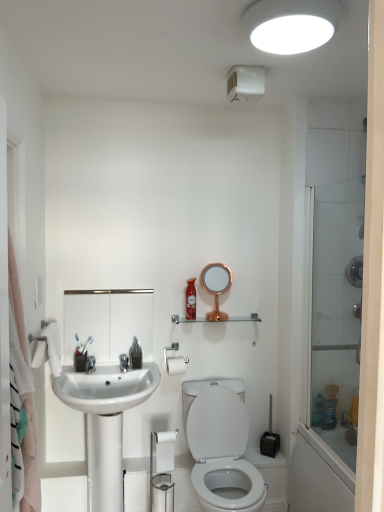
Question: Is white matte toilet paper at center, which appears as the 2th toilet paper when viewed from the front, completely or partially inside white matte toilet paper at lower center, positioned as the second toilet paper in top-to-bottom order?

Choices:
 (A) yes
 (B) no

Answer: (B)

Question: Is white matte toilet paper at lower center, the 1th toilet paper positioned from the bottom, facing away from white matte toilet paper at center, which appears as the 2th toilet paper when viewed from the front?

Choices:
 (A) no
 (B) yes

Answer: (A)

Question: Is white matte toilet paper at lower center, the 2th toilet paper in the back-to-front sequence, oriented towards white matte toilet paper at center, the 1th toilet paper when ordered from top to bottom?

Choices:
 (A) yes
 (B) no

Answer: (B)

Question: Is white matte toilet paper at lower center, the 2th toilet paper in the back-to-front sequence, positioned behind white matte toilet paper at center, the first toilet paper viewed from the back?

Choices:
 (A) yes
 (B) no

Answer: (B)

Question: From a real-world perspective, is white matte toilet paper at lower center, positioned as the second toilet paper in top-to-bottom order, on white matte toilet paper at center, positioned as the 2th toilet paper in bottom-to-top order?

Choices:
 (A) no
 (B) yes

Answer: (A)

Question: Is white glossy toilet at lower center taller or shorter than white matte toilet paper at center, the first toilet paper viewed from the back?

Choices:
 (A) tall
 (B) short

Answer: (A)

Question: Considering the relative positions of white glossy toilet at lower center and white matte toilet paper at center, positioned as the 2th toilet paper in bottom-to-top order, in the image provided, is white glossy toilet at lower center to the left or to the right of white matte toilet paper at center, positioned as the 2th toilet paper in bottom-to-top order,?

Choices:
 (A) right
 (B) left

Answer: (A)

Question: Is white glossy toilet at lower center in front of or behind white matte toilet paper at center, positioned as the 2th toilet paper in bottom-to-top order, in the image?

Choices:
 (A) front
 (B) behind

Answer: (A)

Question: From the image's perspective, is white glossy toilet at lower center positioned above or below white matte toilet paper at center, the 1th toilet paper when ordered from top to bottom?

Choices:
 (A) below
 (B) above

Answer: (A)

Question: Does point coord(314,428) appear closer or farther from the camera than point coord(158,453)?

Choices:
 (A) farther
 (B) closer

Answer: (A)

Question: In terms of height, does transparent glass shower door at right look taller or shorter compared to white matte toilet paper at lower center, the 1th toilet paper positioned from the bottom?

Choices:
 (A) tall
 (B) short

Answer: (A)

Question: From a real-world perspective, is transparent glass shower door at right positioned above or below white matte toilet paper at lower center, positioned as the second toilet paper in top-to-bottom order?

Choices:
 (A) below
 (B) above

Answer: (B)

Question: From the image's perspective, relative to white matte toilet paper at lower center, the 1th toilet paper positioned from the bottom, is transparent glass shower door at right above or below?

Choices:
 (A) above
 (B) below

Answer: (A)

Question: Considering their positions, is white matte toilet paper at center, the first toilet paper viewed from the back, located in front of or behind transparent glass shower door at right?

Choices:
 (A) front
 (B) behind

Answer: (B)

Question: Based on their positions, is white matte toilet paper at center, positioned as the 2th toilet paper in bottom-to-top order, located to the left or right of transparent glass shower door at right?

Choices:
 (A) right
 (B) left

Answer: (B)